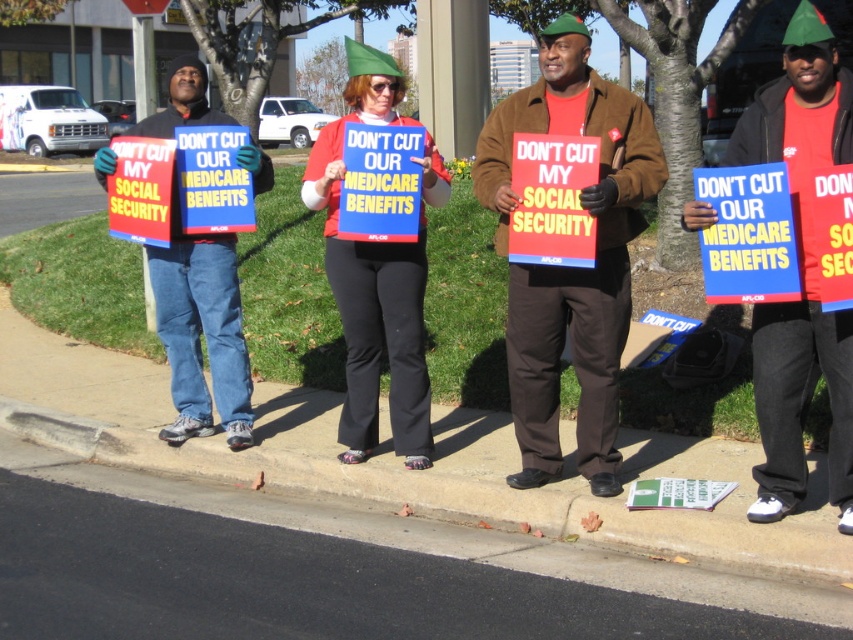
Who is positioned more to the left, matte brown jacket at center or red fabric sign at center?

From the viewer's perspective, matte brown jacket at center appears more on the left side.

Is matte brown jacket at center above red fabric sign at center?

Indeed, matte brown jacket at center is positioned over red fabric sign at center.

Where is `matte brown jacket at center`? The image size is (853, 640). matte brown jacket at center is located at coordinates (566, 266).

In the scene shown: Is concrete at lower left smaller than matte red sign at center?

No, concrete at lower left is not smaller than matte red sign at center.

Is point (724, 504) closer to viewer compared to point (366, 406)?

Yes, point (724, 504) is closer to viewer.

Where is `concrete at lower left`? concrete at lower left is located at coordinates (447, 493).

Image resolution: width=853 pixels, height=640 pixels. What are the coordinates of `concrete at lower left` in the screenshot? It's located at (x=447, y=493).

Does concrete at lower left appear on the right side of red fabric sign at center?

In fact, concrete at lower left is to the left of red fabric sign at center.

Is concrete at lower left wider than red fabric sign at center?

Yes, concrete at lower left is wider than red fabric sign at center.

Is point (460, 508) closer to camera compared to point (767, 490)?

No.

Image resolution: width=853 pixels, height=640 pixels. Identify the location of concrete at lower left. (447, 493).